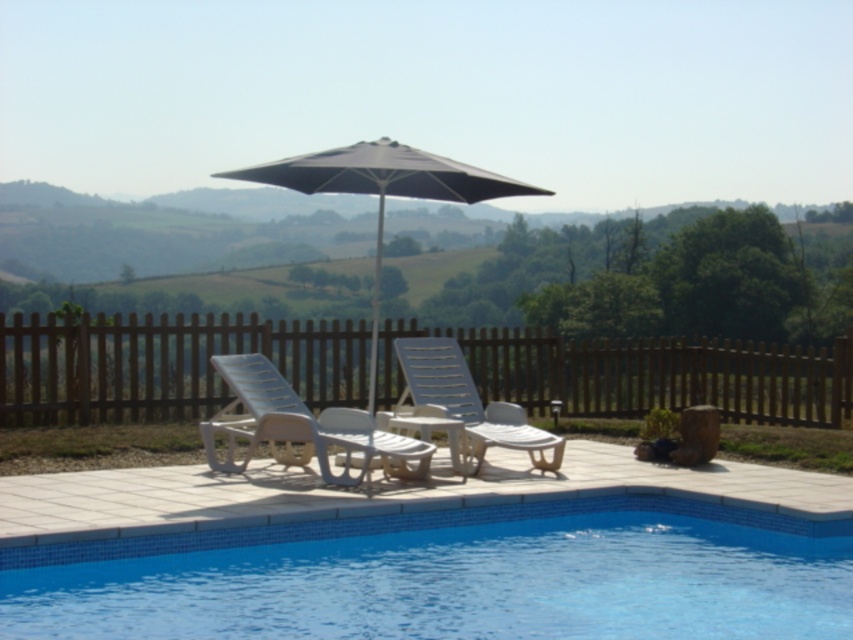
Question: Does blue tile swimming pool at lower center appear on the left side of dark gray fabric umbrella at center?

Choices:
 (A) yes
 (B) no

Answer: (B)

Question: Which object appears closest to the camera in this image?

Choices:
 (A) white plastic lounge chair at center
 (B) dark gray fabric umbrella at center

Answer: (B)

Question: Where is dark gray fabric umbrella at center located in relation to white plastic lounge chair at center in the image?

Choices:
 (A) right
 (B) left

Answer: (B)

Question: Which point is closer to the camera?

Choices:
 (A) (405, 458)
 (B) (375, 173)
 (C) (845, 376)
 (D) (408, 371)

Answer: (A)

Question: Does brown wooden fence at center have a larger size compared to white plastic beach chair at center?

Choices:
 (A) yes
 (B) no

Answer: (A)

Question: Which object appears closest to the camera in this image?

Choices:
 (A) brown wooden fence at center
 (B) white plastic beach chair at center
 (C) blue tile swimming pool at lower center

Answer: (C)